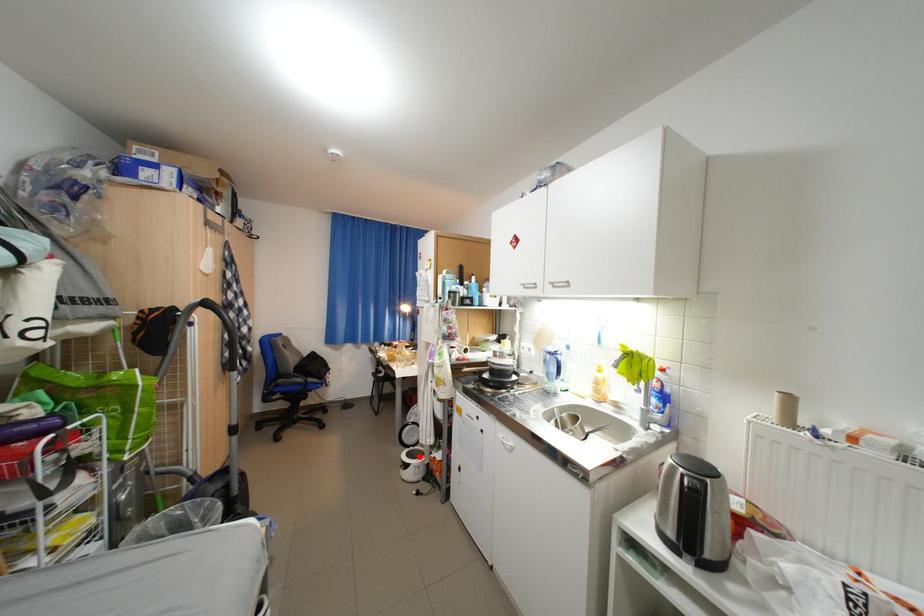
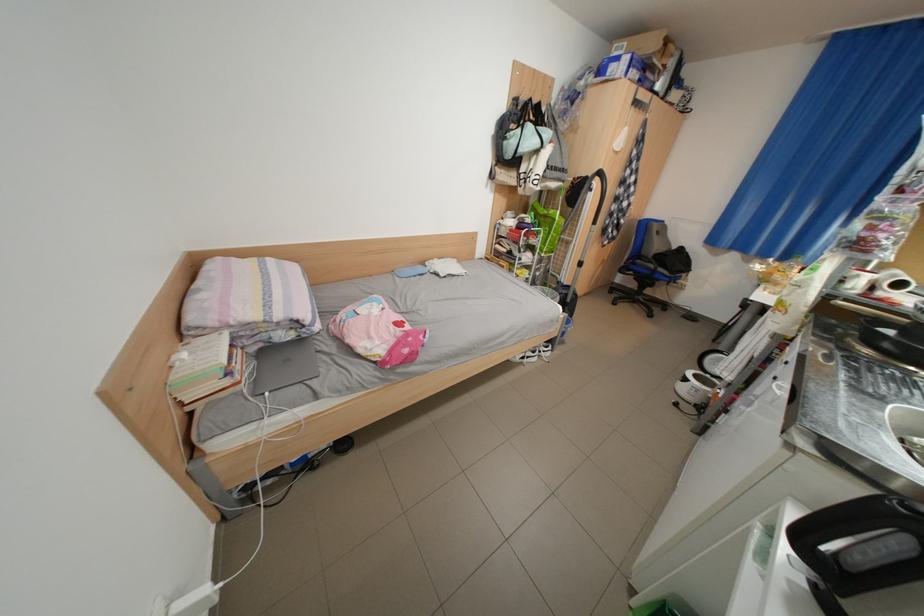
Question: I am providing you with two images of the same scene from different viewpoints. Image1 has a red point marked. In image2, the corresponding 3D location appears at what relative position? Reply with the corresponding letter.

Choices:
 (A) Closer
 (B) Farther

Answer: (A)